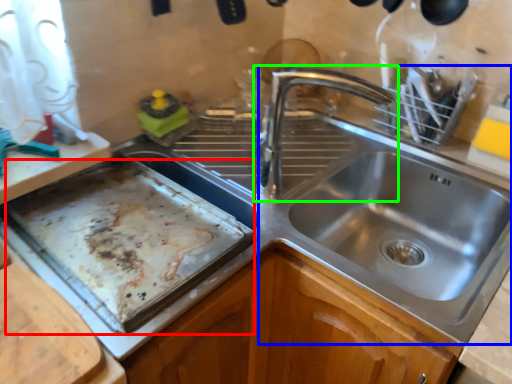
Question: Based on their relative distances, which object is nearer to baking sheet (highlighted by a red box)? Choose from sink (highlighted by a blue box) and tap (highlighted by a green box).

Choices:
 (A) sink
 (B) tap

Answer: (B)